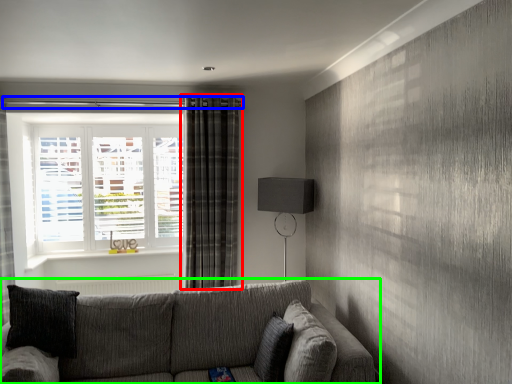
Question: Which is nearer to the curtain (highlighted by a red box)? beam (highlighted by a blue box) or studio couch (highlighted by a green box).

Choices:
 (A) beam
 (B) studio couch

Answer: (A)